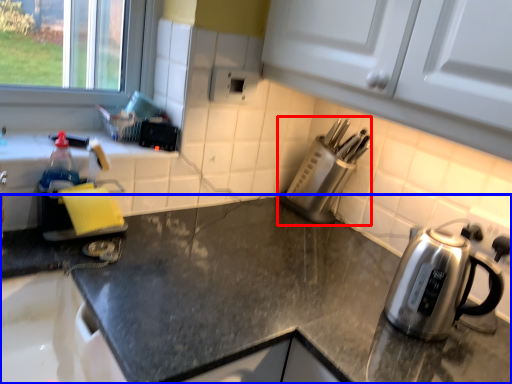
Question: Which object is closer to the camera taking this photo, appliance (highlighted by a red box) or countertop (highlighted by a blue box)?

Choices:
 (A) appliance
 (B) countertop

Answer: (B)